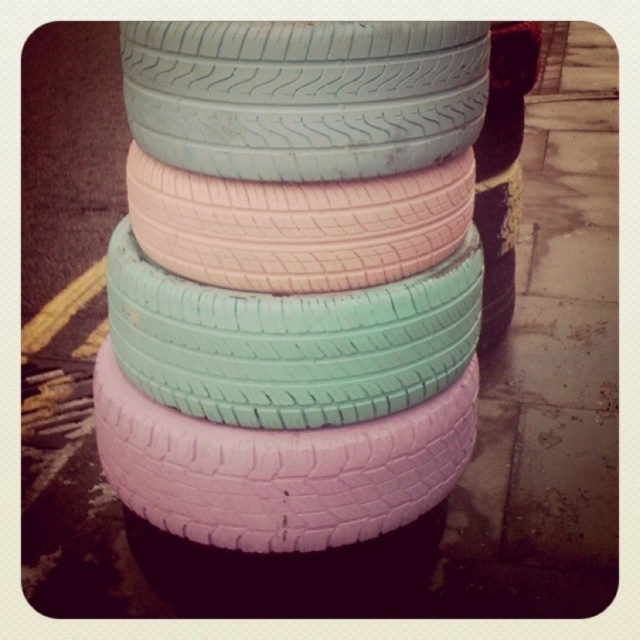
Question: Estimate the real-world distances between objects in this image. Which object is farther from the pink matte tire at center?

Choices:
 (A) pastel matte tires at center
 (B) light blue rubber tire at center

Answer: (B)

Question: Can you confirm if pastel matte tires at center is wider than pink matte tire at center?

Choices:
 (A) no
 (B) yes

Answer: (B)

Question: Is pastel matte tires at center smaller than light blue rubber tire at center?

Choices:
 (A) yes
 (B) no

Answer: (B)

Question: Which point is farther to the camera?

Choices:
 (A) (433, 48)
 (B) (294, 589)
 (C) (266, 433)

Answer: (B)

Question: Which point is farther from the camera taking this photo?

Choices:
 (A) (218, 531)
 (B) (429, 157)

Answer: (A)

Question: Does light blue rubber tire at center appear over pink matte tire at center?

Choices:
 (A) no
 (B) yes

Answer: (B)